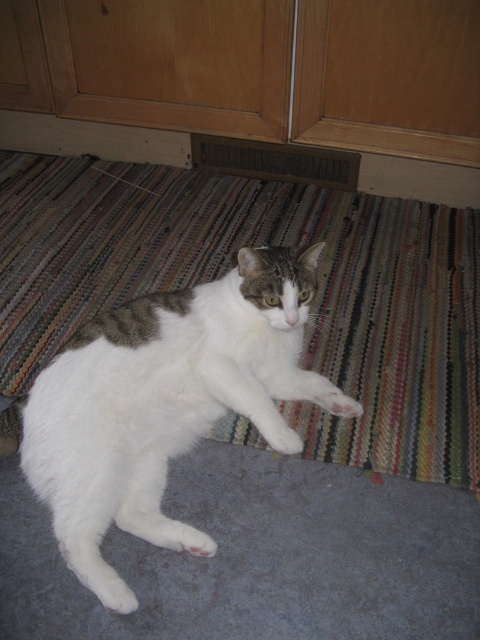
How far apart are white fur cat at lower left and white fur cat at center?

white fur cat at lower left and white fur cat at center are 7.67 inches apart from each other.

Is point (240, 460) more distant than point (183, 372)?

Yes, point (240, 460) is behind point (183, 372).

At what (x,y) coordinates should I click in order to perform the action: click on white fur cat at lower left. Please return your answer as a coordinate pair (x, y). The image size is (480, 640). Looking at the image, I should click on (260, 556).

Can you confirm if striped carpet at lower center is bigger than white fur cat at lower left?

Yes.

Does point (15, 236) come in front of point (466, 544)?

No, it is behind (466, 544).

At what (x,y) coordinates should I click in order to perform the action: click on striped carpet at lower center. Please return your answer as a coordinate pair (x, y). The height and width of the screenshot is (640, 480). Looking at the image, I should click on (235, 262).

Between point (24, 193) and point (224, 362), which one is positioned behind?

The point (24, 193) is behind.

Where is `striped carpet at lower center`? The height and width of the screenshot is (640, 480). striped carpet at lower center is located at coordinates (235, 262).

Where is `striped carpet at lower center`? The image size is (480, 640). striped carpet at lower center is located at coordinates (235, 262).

Locate an element on the screen. striped carpet at lower center is located at coordinates (235, 262).